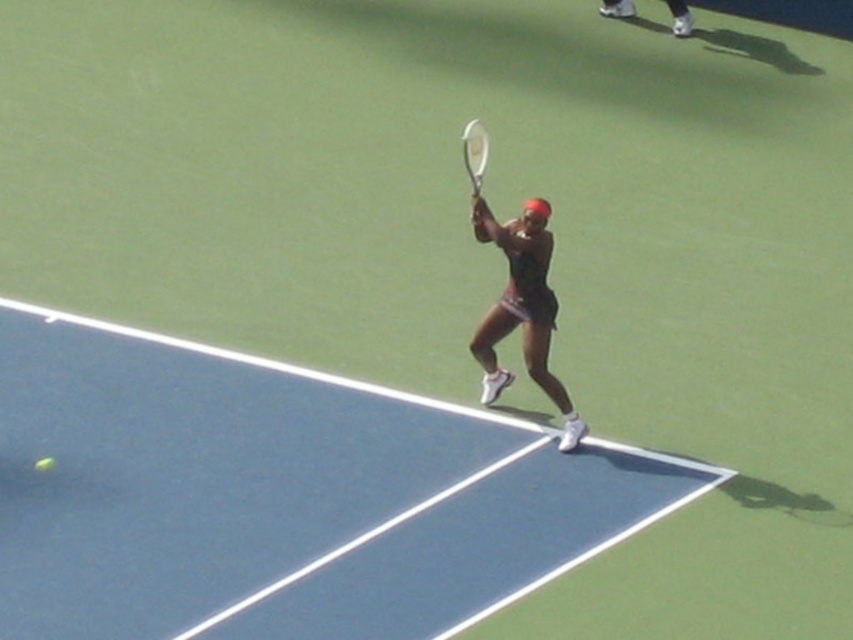
You are a tennis ball that just bounced on the blue rubber tennis court at center. Where did you land? Please provide the coordinates of the landing point in the format of a point like this example format point (277, 496).

The tennis ball landed at point (277, 496) on the blue rubber tennis court at center.

In the scene shown: You are a tennis instructor observing a student practicing on the blue rubber tennis court at center. You notice the black matte tennis racket at center. Can you determine if the racket is positioned higher or lower than the court surface?

The blue rubber tennis court at center is taller than black matte tennis racket at center, so the racket is positioned lower than the court surface.